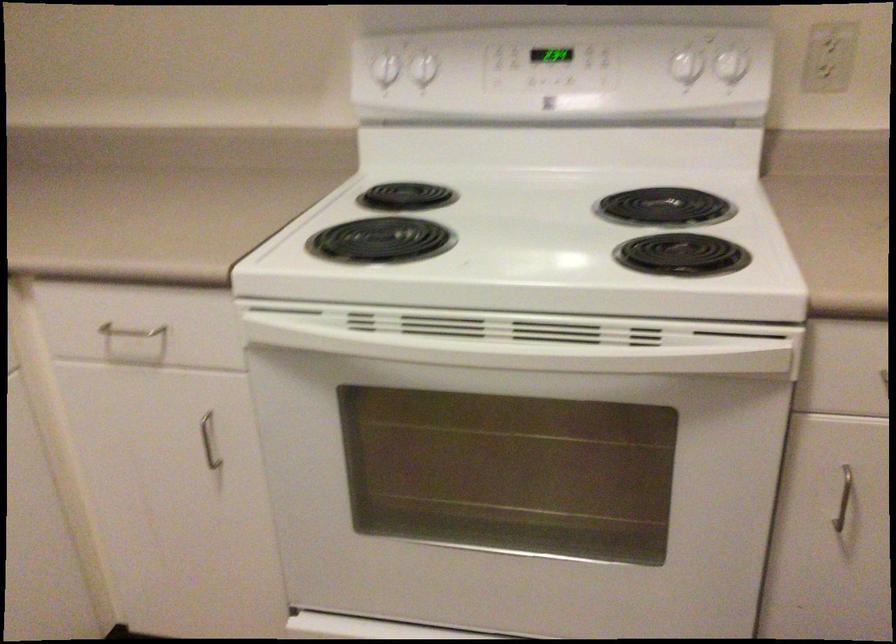
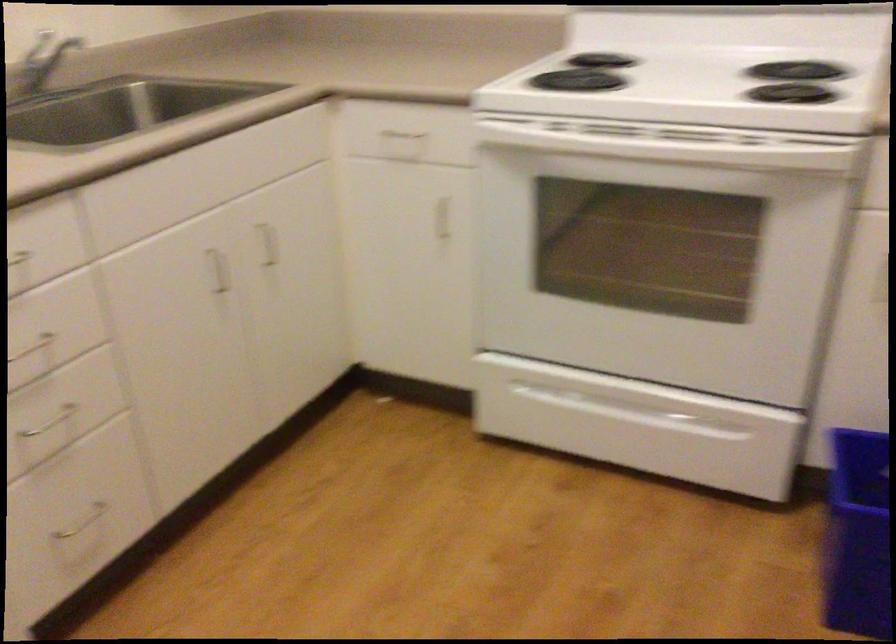
Question: In a continuous first-person perspective shot, in which direction is the camera moving?

Choices:
 (A) Left
 (B) Right
 (C) Forward
 (D) Backward

Answer: (D)